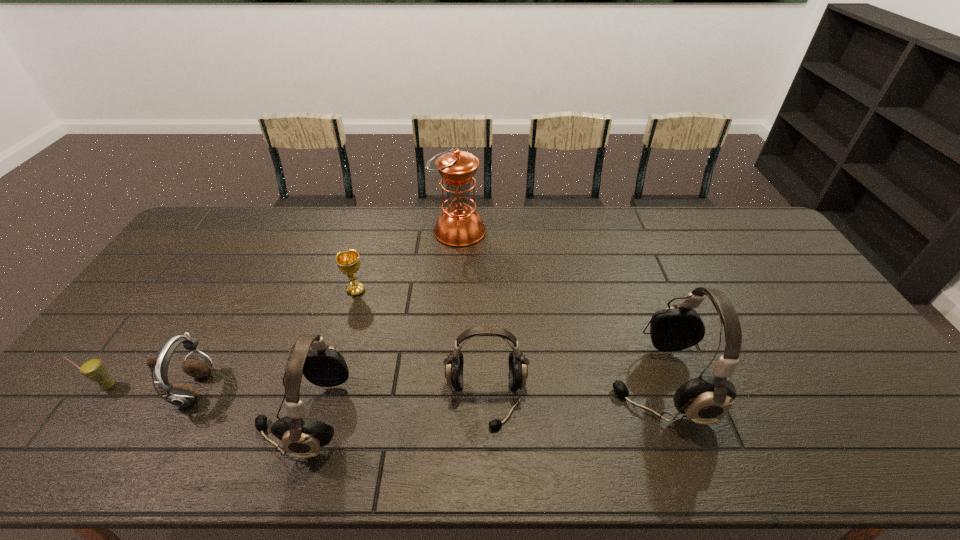
The width and height of the screenshot is (960, 540). Find the location of `free space between the earphone and the rightmost headset`. free space between the earphone and the rightmost headset is located at coordinates (426, 386).

Image resolution: width=960 pixels, height=540 pixels. I want to click on free spot between the chalice and the oil lamp, so click(408, 261).

Locate an element on the screen. This screenshot has width=960, height=540. empty space that is in between the leftmost object and the sixth nearest object is located at coordinates (232, 338).

What are the coordinates of `vacant region between the second headset from right to left and the chalice` in the screenshot? It's located at (421, 345).

I want to click on free space between the second headset from left to right and the second object from left to right, so click(341, 394).

Where is `free space between the farthest object and the earphone`? free space between the farthest object and the earphone is located at coordinates (327, 310).

Locate an element on the screen. free space between the leftmost object and the second shortest headset is located at coordinates (206, 401).

Locate an element on the screen. This screenshot has width=960, height=540. object that is the fourth closest one to the second farthest object is located at coordinates (518, 370).

Find the location of `object that stands as the sixth closest to the oil lamp`. object that stands as the sixth closest to the oil lamp is located at coordinates (93, 369).

Point out which headset is positioned as the second nearest to the second headset from right to left. Please provide its 2D coordinates. Your answer should be formatted as a tuple, i.e. [(x, y)], where the tuple contains the x and y coordinates of a point satisfying the conditions above.

[(324, 366)]